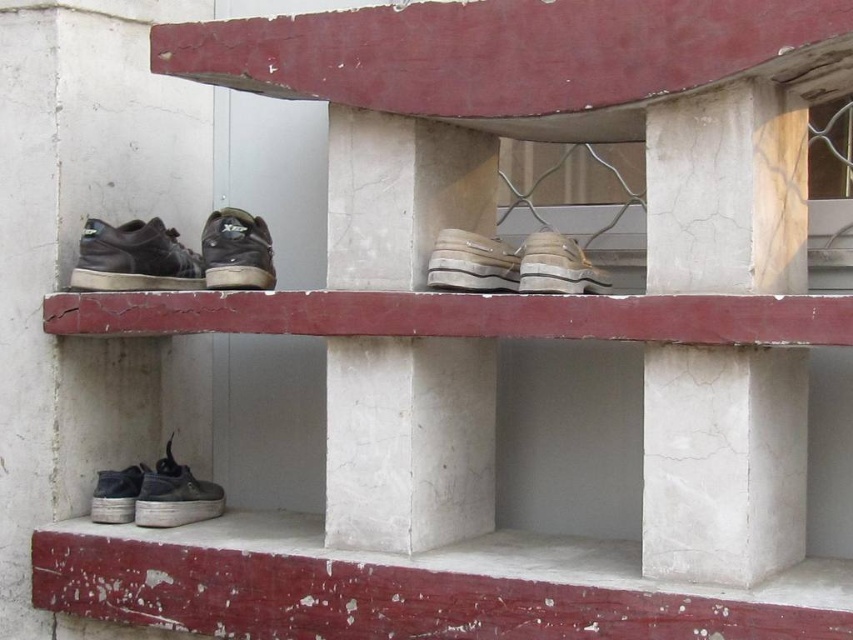
You are a delivery person who needs to place a small package between the worn leather shoe at center and the white rubber shoe at center. Can the package fit between them if the package is 10 cm wide?

The worn leather shoe at center is narrower than the white rubber shoe at center. Since the package is 10 cm wide, it depends on the actual space between them. However, the description only states the width of the shoes, not the distance between them. Therefore, we cannot determine if the package will fit based on the given information.

From the picture: You are standing on the concrete structure looking at the shiny black sneaker at center and the worn leather shoe at center. Which shoe is closer to you?

The shiny black sneaker at center is closer to you because the worn leather shoe at center is behind it.

You are standing on the concrete structure and want to pick up the worn leather shoe at center and the white rubber shoe at center. Which shoe should you reach for first to pick up the one closer to you?

You should pick up the worn leather shoe at center first because it is closer to you than the white rubber shoe at center.